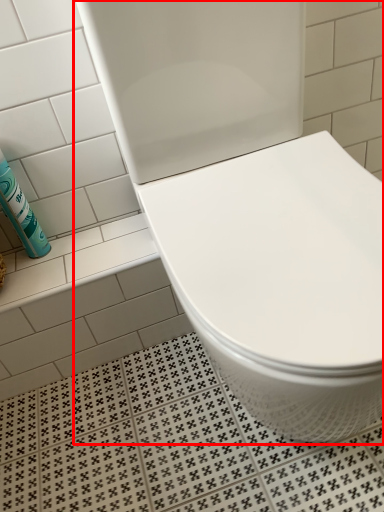
Question: Considering the relative positions of toilet (annotated by the red box) and cleaning product in the image provided, where is toilet (annotated by the red box) located with respect to the staircase?

Choices:
 (A) left
 (B) right

Answer: (B)